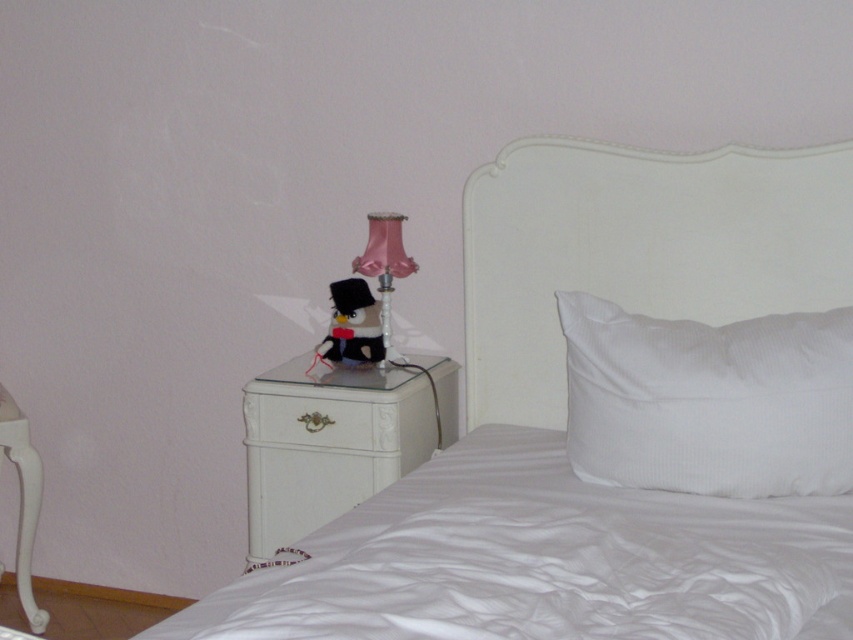
You are standing in the bedroom and want to place a small plant between the two points, point (260, 397) and point (399, 236). Which point should the plant be closer to in order to be nearer to you?

The plant should be closer to point (260, 397) because it is nearer to the viewer than point (399, 236).

You are standing in the bedroom and want to place a new painting between the white matte headboard at upper right and the velvet black plush at upper center. Based on their positions, where should you position the painting?

Since the white matte headboard at upper right is to the right of the velvet black plush at upper center, you should place the painting between them, positioning it to the left of the white matte headboard at upper right and to the right of the velvet black plush at upper center.

You are trying to place a 16 inch wide decorative box between the white satin bed at center and the white glossy dresser at lower left. Can it fit without overlapping either?

The distance between the white satin bed at center and the white glossy dresser at lower left is 15.39 inches, which is less than the 16 inch width of the box. Therefore, the box cannot fit between them without overlapping.